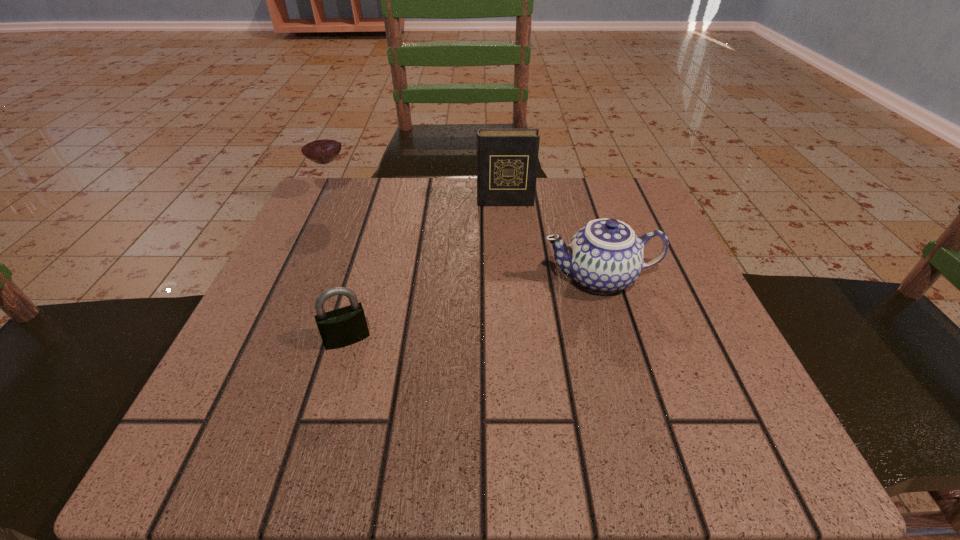
This screenshot has width=960, height=540. In order to click on diary in this screenshot , I will do `click(507, 159)`.

This screenshot has width=960, height=540. In order to click on wineglass in this screenshot , I will do `click(320, 144)`.

The height and width of the screenshot is (540, 960). Find the location of `the second nearest object`. the second nearest object is located at coordinates (605, 256).

Find the location of a particular element. The image size is (960, 540). the nearest object is located at coordinates (345, 326).

Locate an element on the screen. The image size is (960, 540). the third object from right to left is located at coordinates (345, 326).

This screenshot has width=960, height=540. Identify the location of vacant space located 0.050m on the front cover of the diary. (506, 220).

You are a GUI agent. You are given a task and a screenshot of the screen. Output one action in this format:
    pyautogui.click(x=<x>, y=<y>)
    Task: Click on the free location located 0.280m on the front of the wineglass
    The image size is (960, 540).
    Given the screenshot: What is the action you would take?
    pyautogui.click(x=287, y=296)

The width and height of the screenshot is (960, 540). What are the coordinates of `free space located from the spout of the second nearest object` in the screenshot? It's located at click(479, 278).

This screenshot has width=960, height=540. Identify the location of vacant area located 0.140m from the spout of the second nearest object. (462, 278).

This screenshot has height=540, width=960. Find the location of `free space located 0.090m from the spout of the second nearest object`. free space located 0.090m from the spout of the second nearest object is located at coordinates (491, 278).